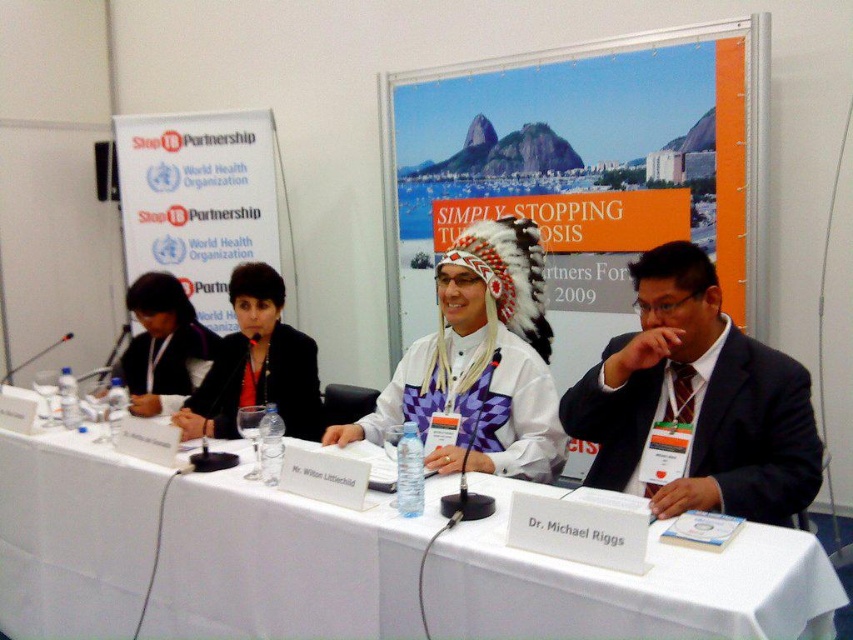
You are standing in front of the panel discussion setup and want to reach both the point at coordinates point (x=753, y=385) and point (x=181, y=362). Which point will you reach first?

You will reach point (x=753, y=385) first because it is closer to you than point (x=181, y=362).

You are organizing a panel discussion and need to ensure there is enough space between the white feather headdress at center and the matte black jacket at upper left for a microphone stand. The stand requires at least 1 meter of space. Is there sufficient space?

The white feather headdress at center is 1.23 meters from the matte black jacket at upper left, which is more than the required 1 meter, so there is sufficient space for the microphone stand.